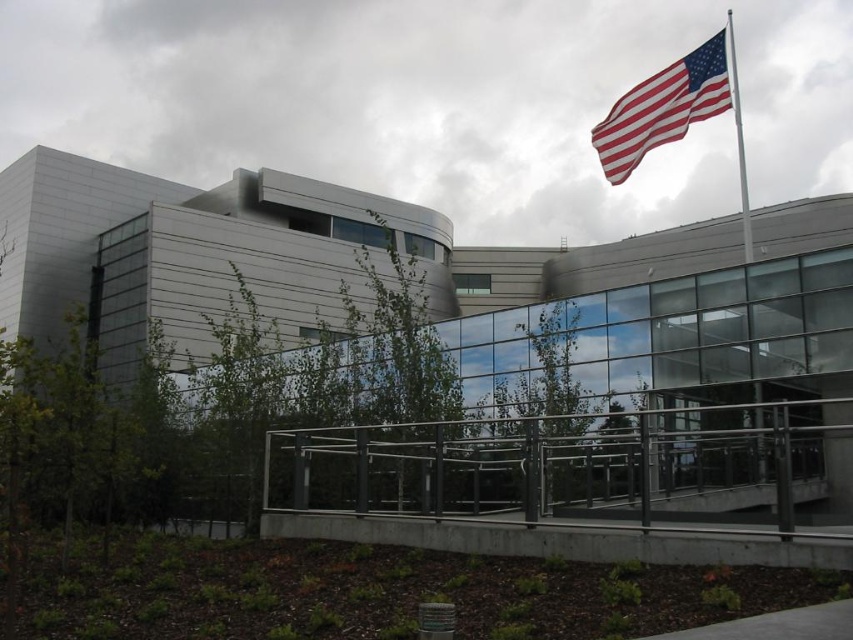
Question: Which point appears farthest from the camera in this image?

Choices:
 (A) (660, 132)
 (B) (738, 129)

Answer: (B)

Question: Can you confirm if red-white striped fabric flag at upper right is positioned below white metallic flag pole at upper right?

Choices:
 (A) no
 (B) yes

Answer: (A)

Question: Is red-white striped fabric flag at upper right to the right of white metallic flag pole at upper right from the viewer's perspective?

Choices:
 (A) no
 (B) yes

Answer: (A)

Question: Can you confirm if red-white striped fabric flag at upper right is bigger than white metallic flag pole at upper right?

Choices:
 (A) no
 (B) yes

Answer: (A)

Question: Which of the following is the closest to the observer?

Choices:
 (A) white metallic flag pole at upper right
 (B) red-white striped fabric flag at upper right

Answer: (B)